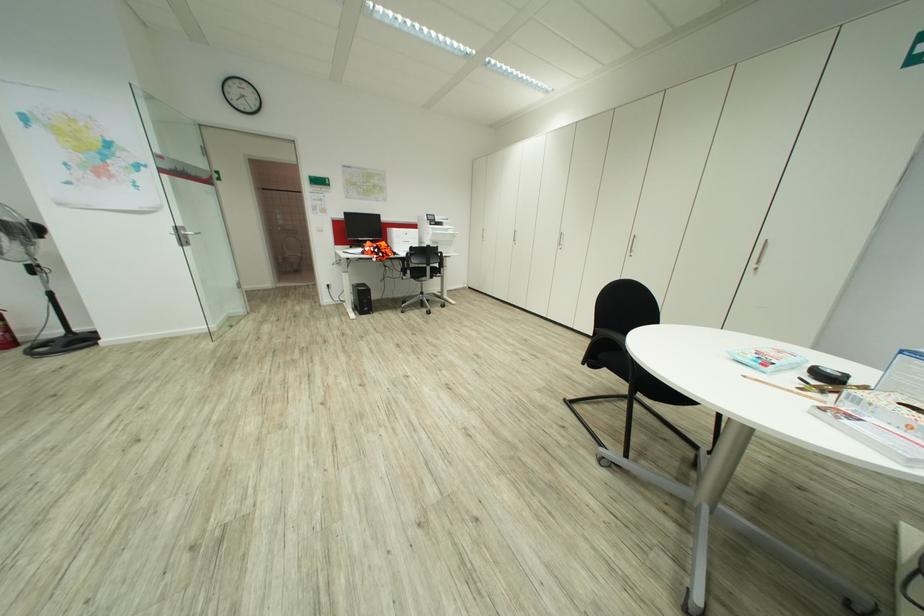
You are a GUI agent. You are given a task and a screenshot of the screen. Output one action in this format:
    pyautogui.click(x=<x>, y=<y>)
    Task: Click on the metal door handle
    
    Given the screenshot: What is the action you would take?
    pyautogui.click(x=193, y=232)